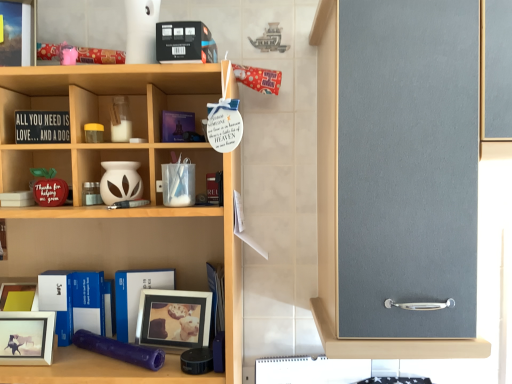
Question: Is matte purple book at center, the fourth book ordered from the bottom, facing towards wooden shelf at center?

Choices:
 (A) no
 (B) yes

Answer: (B)

Question: Would you say wooden shelf at center is part of matte purple book at center, the fourth book ordered from the bottom,'s contents?

Choices:
 (A) yes
 (B) no

Answer: (B)

Question: Is matte purple book at center, arranged as the 3th book when viewed from the top, further to camera compared to wooden shelf at center?

Choices:
 (A) no
 (B) yes

Answer: (B)

Question: From a real-world perspective, is matte purple book at center, the fourth book ordered from the bottom, beneath wooden shelf at center?

Choices:
 (A) no
 (B) yes

Answer: (A)

Question: Is matte purple book at center, arranged as the 3th book when viewed from the top, wider than wooden shelf at center?

Choices:
 (A) no
 (B) yes

Answer: (A)

Question: Is matte purple book at center, arranged as the 3th book when viewed from the top, facing away from wooden shelf at center?

Choices:
 (A) no
 (B) yes

Answer: (B)

Question: Considering the relative positions of white matte picture frame at lower left, the second picture frame from the right, and blue hardcover book at center, which is the fifth book from top to bottom, in the image provided, is white matte picture frame at lower left, the second picture frame from the right, to the right of blue hardcover book at center, which is the fifth book from top to bottom, from the viewer's perspective?

Choices:
 (A) no
 (B) yes

Answer: (A)

Question: Can you confirm if white matte picture frame at lower left, placed as the 2th picture frame when sorted from back to front, is positioned to the left of blue hardcover book at center, which is the fifth book from top to bottom?

Choices:
 (A) yes
 (B) no

Answer: (A)

Question: Would you say blue hardcover book at center, placed as the 2th book when sorted from bottom to top, is part of white matte picture frame at lower left, the 1th picture frame from the front,'s contents?

Choices:
 (A) no
 (B) yes

Answer: (A)

Question: Considering the relative sizes of white matte picture frame at lower left, the first picture frame positioned from the left, and blue hardcover book at center, which is the fifth book from top to bottom, in the image provided, is white matte picture frame at lower left, the first picture frame positioned from the left, thinner than blue hardcover book at center, which is the fifth book from top to bottom,?

Choices:
 (A) no
 (B) yes

Answer: (A)

Question: Is white matte picture frame at lower left, placed as the 2th picture frame when sorted from back to front, smaller than blue hardcover book at center, which is the fifth book from top to bottom?

Choices:
 (A) yes
 (B) no

Answer: (B)

Question: Is white matte picture frame at lower left, the first picture frame positioned from the left, outside blue hardcover book at center, placed as the 2th book when sorted from bottom to top?

Choices:
 (A) no
 (B) yes

Answer: (B)

Question: From a real-world perspective, is blue hardcover book at center, marked as the 3th book in a bottom-to-top arrangement, under black matte book at upper center, placed as the 6th book when sorted from bottom to top?

Choices:
 (A) yes
 (B) no

Answer: (A)